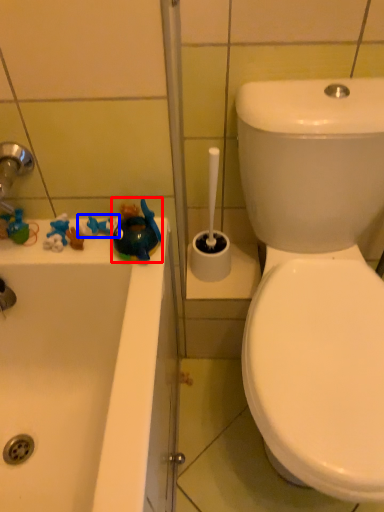
Question: Which of the following is the closest to the observer, toy (highlighted by a red box) or toy (highlighted by a blue box)?

Choices:
 (A) toy
 (B) toy

Answer: (A)